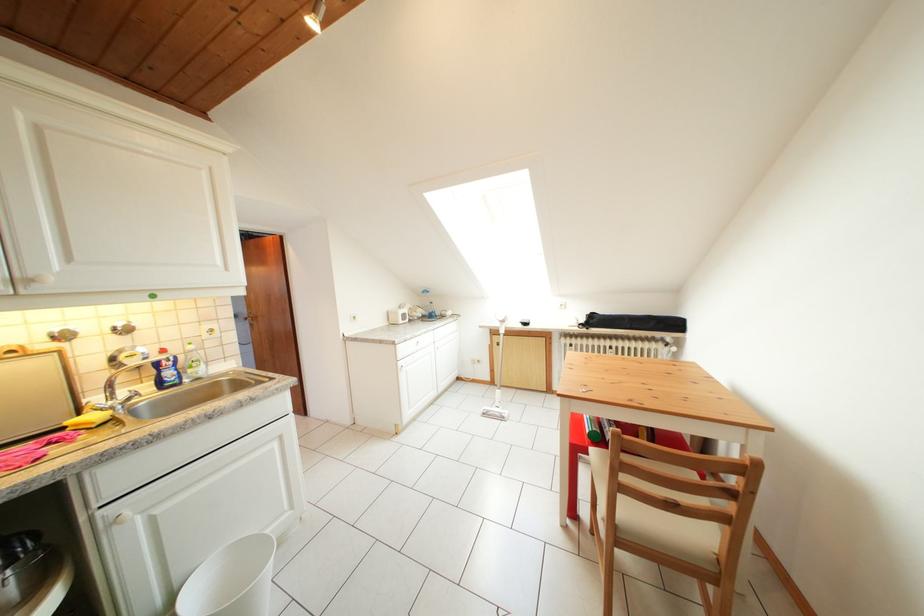
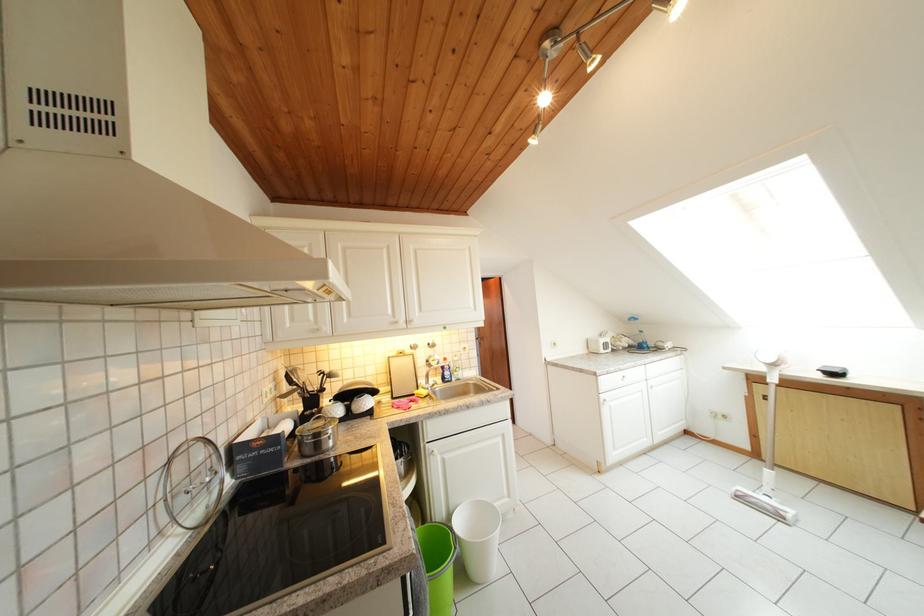
The point at (91, 524) is marked in the first image. Where is the corresponding point in the second image?

(431, 451)